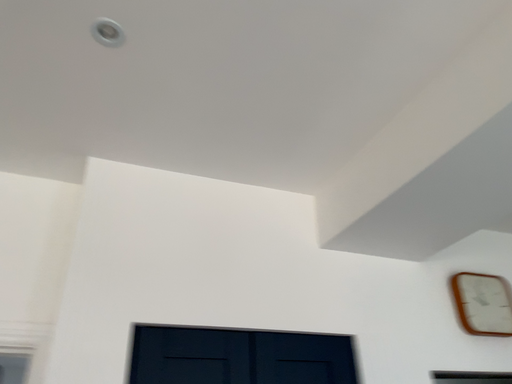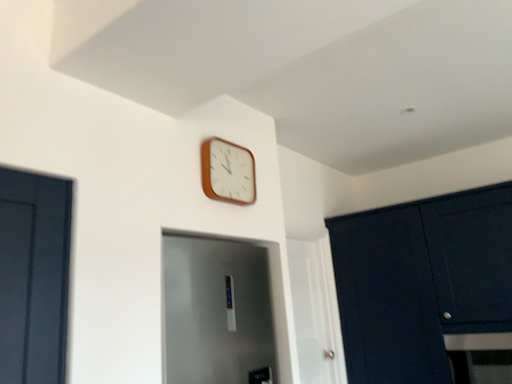
Question: How did the camera likely rotate when shooting the video?

Choices:
 (A) rotated right
 (B) rotated left

Answer: (A)